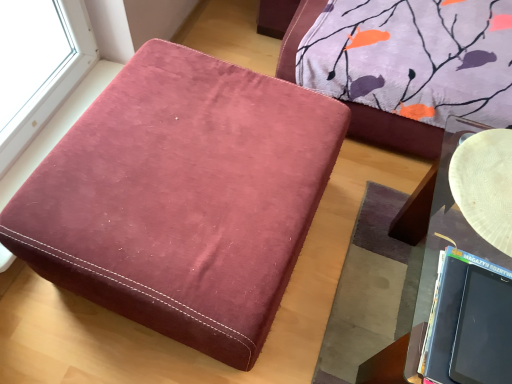
Where is `blank space situated above matte black laptop at lower right (from a real-world perspective)`? blank space situated above matte black laptop at lower right (from a real-world perspective) is located at coordinates (476, 318).